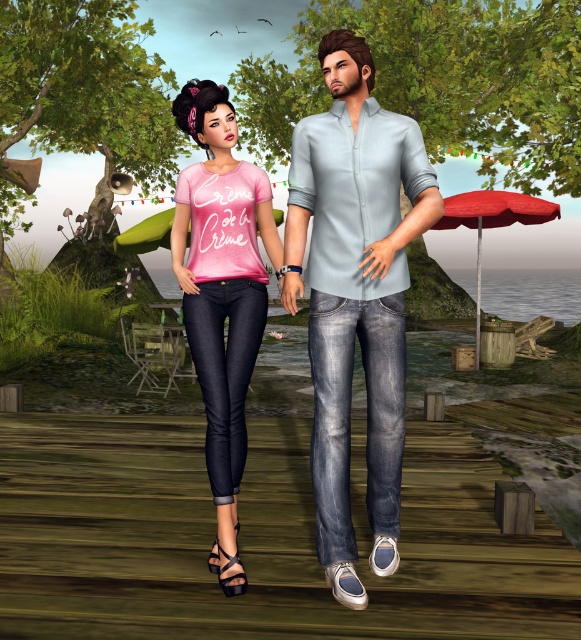
Question: Among these objects, which one is nearest to the camera?

Choices:
 (A) light blue denim jeans at center
 (B) pink matte t-shirt at center
 (C) red fabric umbrella at right
 (D) pink fabric umbrella at center

Answer: (A)

Question: Can you confirm if light blue denim jeans at center is thinner than red fabric umbrella at right?

Choices:
 (A) yes
 (B) no

Answer: (A)

Question: Does light blue denim jeans at center have a lesser width compared to pink fabric umbrella at center?

Choices:
 (A) yes
 (B) no

Answer: (A)

Question: Which point appears closest to the camera in this image?

Choices:
 (A) (210, 292)
 (B) (116, 246)

Answer: (A)

Question: Among these points, which one is farthest from the camera?

Choices:
 (A) [345, 602]
 (B) [202, 305]
 (C) [164, 211]
 (D) [507, 193]

Answer: (D)

Question: Can you confirm if light blue denim jeans at center is positioned below pink matte t-shirt at center?

Choices:
 (A) yes
 (B) no

Answer: (B)